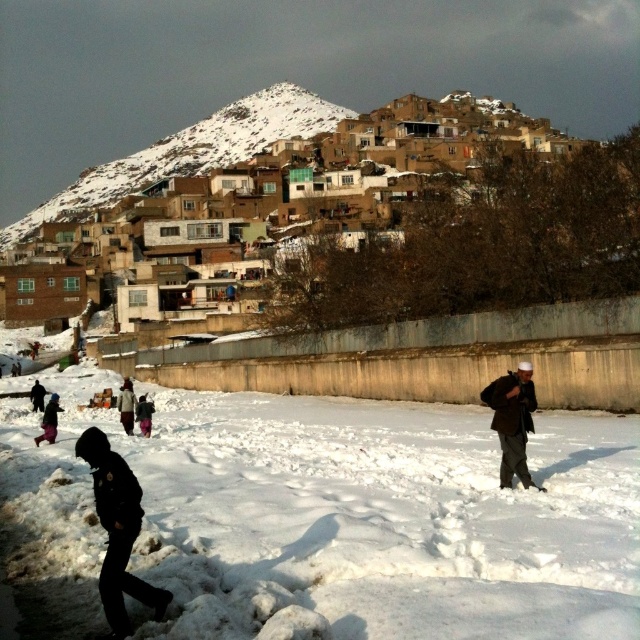
Who is taller, white powdery snow at lower center or brown clay houses at upper center?

With more height is brown clay houses at upper center.

Is white powdery snow at lower center smaller than brown clay houses at upper center?

Yes, white powdery snow at lower center is smaller than brown clay houses at upper center.

This screenshot has width=640, height=640. What do you see at coordinates (330, 518) in the screenshot? I see `white powdery snow at lower center` at bounding box center [330, 518].

Locate an element on the screen. This screenshot has height=640, width=640. white powdery snow at lower center is located at coordinates (330, 518).

Who is more distant from viewer, (240, 116) or (134, 412)?

The point (240, 116) is more distant.

Does brown clay houses at upper center have a larger size compared to dark brown woolen coat at lower left?

Correct, brown clay houses at upper center is larger in size than dark brown woolen coat at lower left.

Who is more forward, (216, 129) or (138, 417)?

Point (138, 417) is more forward.

What are the coordinates of `brown clay houses at upper center` in the screenshot? It's located at (189, 150).

Who is positioned more to the right, dark brown leather bag at lower right or dark brown jacket at lower left?

dark brown leather bag at lower right is more to the right.

Which is above, dark brown leather bag at lower right or dark brown jacket at lower left?

Positioned higher is dark brown leather bag at lower right.

You are a GUI agent. You are given a task and a screenshot of the screen. Output one action in this format:
    pyautogui.click(x=<x>, y=<y>)
    Task: Click on the dark brown leather bag at lower right
    The image size is (640, 640).
    Given the screenshot: What is the action you would take?
    pyautogui.click(x=513, y=420)

Locate an element on the screen. This screenshot has width=640, height=640. dark brown leather bag at lower right is located at coordinates (513, 420).